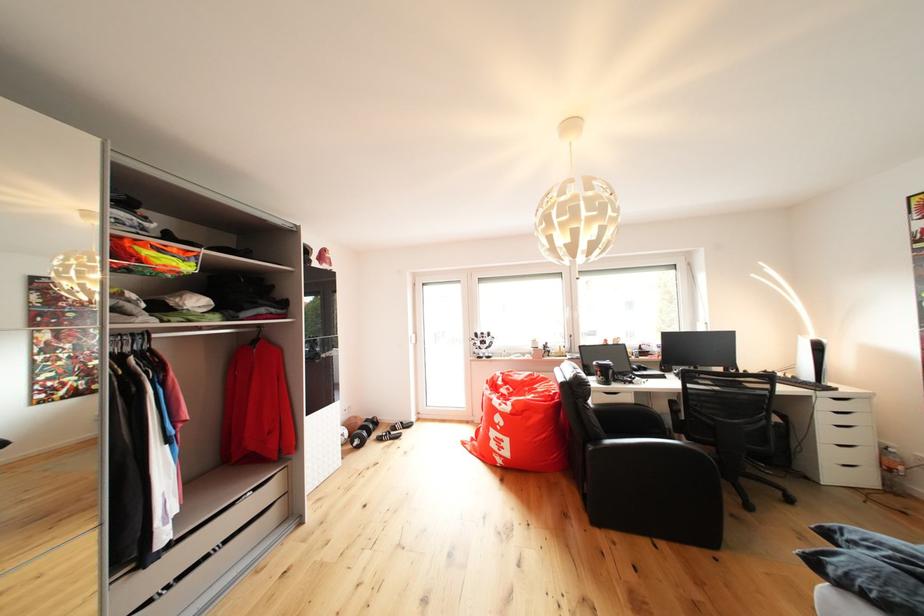
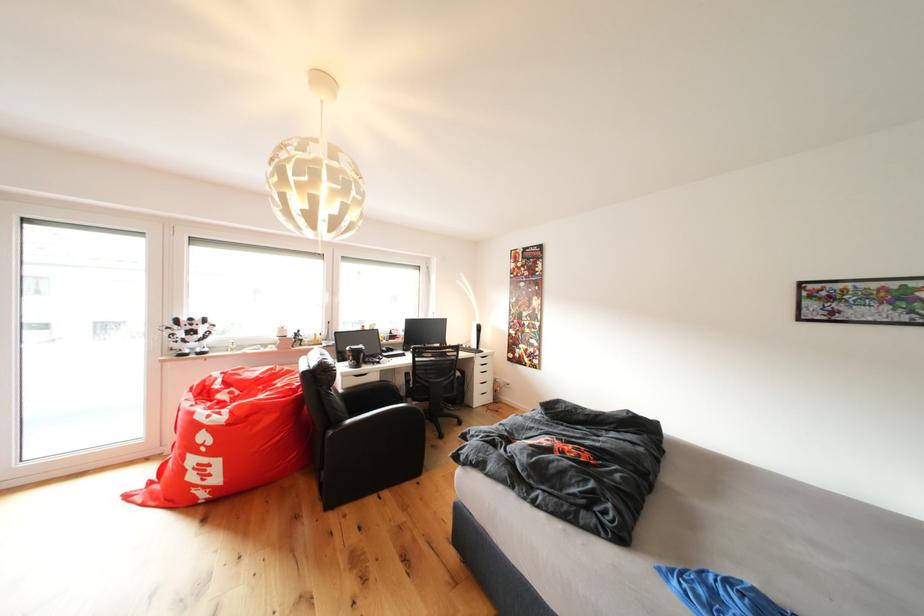
Locate, in the second image, the point that corresponds to the point at 609,371 in the first image.

(361, 355)